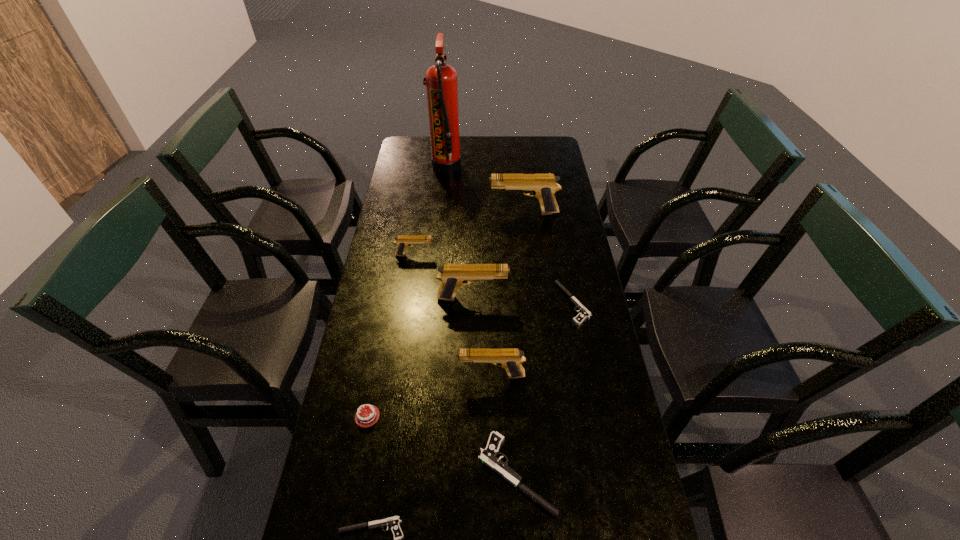
This screenshot has width=960, height=540. What are the coordinates of `free space located on the front-facing side of the farthest black pistol` in the screenshot? It's located at (507, 303).

Identify the location of free space located 0.340m on the front-facing side of the farthest black pistol. (449, 303).

This screenshot has height=540, width=960. What are the coordinates of `object that is positioned at the far edge` in the screenshot? It's located at (441, 83).

The height and width of the screenshot is (540, 960). In order to click on fire extinguisher that is positioned at the left edge in this screenshot , I will do `click(441, 83)`.

Find the location of a particular element. Image resolution: width=960 pixels, height=540 pixels. pistol at the left edge is located at coordinates (402, 241).

Where is `chocolate cake present at the left edge`? The height and width of the screenshot is (540, 960). chocolate cake present at the left edge is located at coordinates (366, 417).

This screenshot has height=540, width=960. Find the location of `object located in the far left corner section of the desktop`. object located in the far left corner section of the desktop is located at coordinates (441, 83).

In the image, there is a desktop. Where is `free space at the far edge`? This screenshot has height=540, width=960. free space at the far edge is located at coordinates (516, 151).

Identify the location of blank space at the left edge of the desktop. The image size is (960, 540). [420, 211].

Where is `free point at the right edge`? Image resolution: width=960 pixels, height=540 pixels. free point at the right edge is located at coordinates (580, 505).